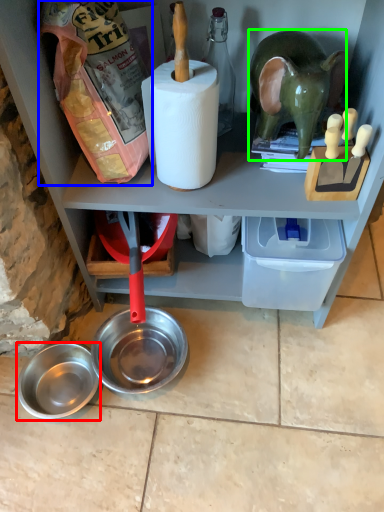
Question: Estimate the real-world distances between objects in this image. Which object is farther from bowl (highlighted by a red box), stuff (highlighted by a blue box) or animal (highlighted by a green box)?

Choices:
 (A) stuff
 (B) animal

Answer: (B)